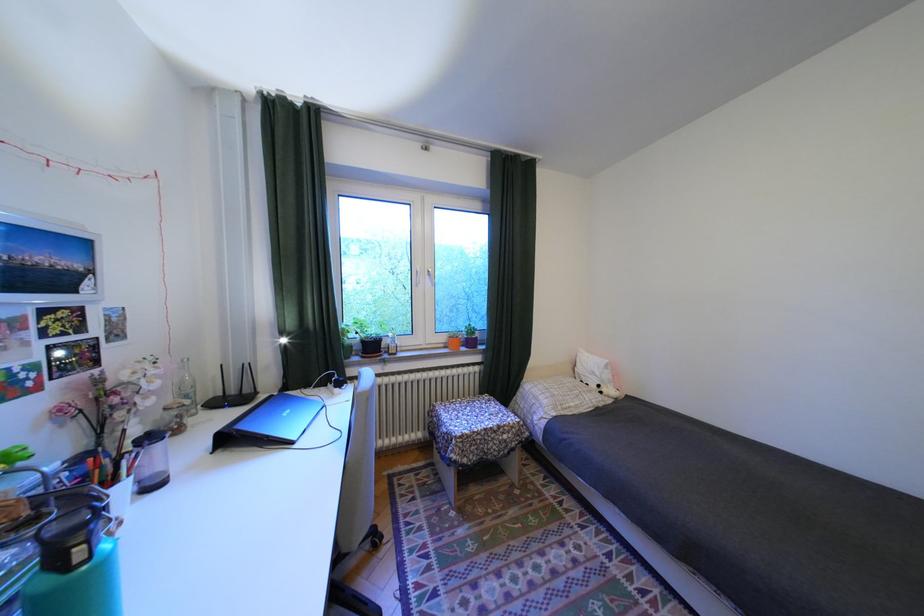
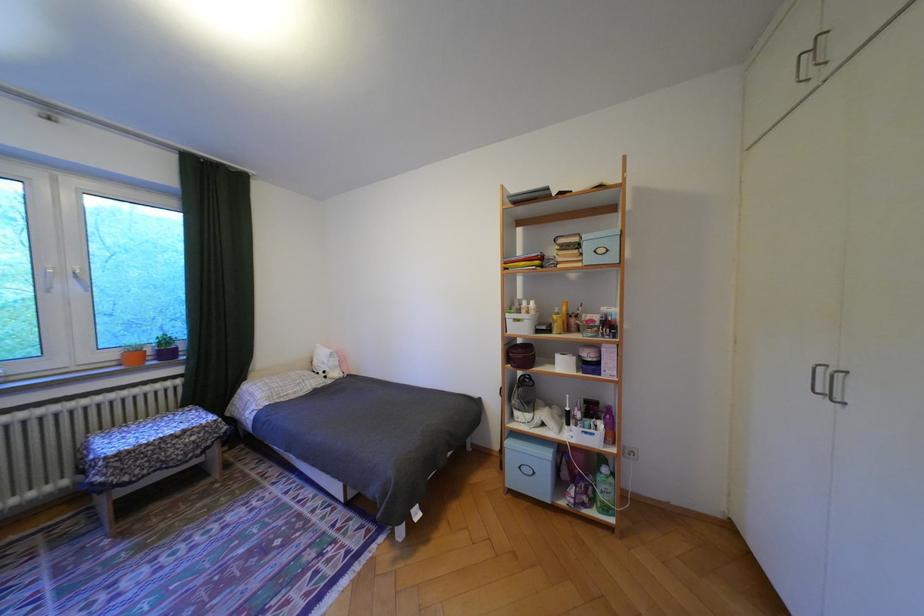
Question: I am providing you with two images of the same scene from different viewpoints. Please identify which objects are invisible in image2.

Choices:
 (A) yellow spray bottle
 (B) purple flower pot
 (C) maroon round case
 (D) none of these

Answer: (D)